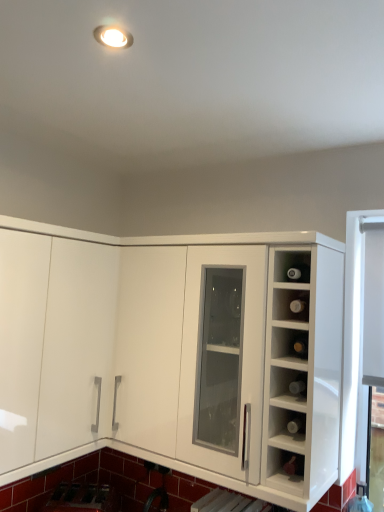
What do you see at coordinates (171, 354) in the screenshot? This screenshot has height=512, width=384. I see `white glossy cabinet at center` at bounding box center [171, 354].

Where is `metallic silver sink at lower left`? metallic silver sink at lower left is located at coordinates (82, 498).

You are a GUI agent. You are given a task and a screenshot of the screen. Output one action in this format:
    pyautogui.click(x=<x>, y=<y>)
    Task: Click on the white glossy cabinet at center
    The height and width of the screenshot is (512, 384).
    Given the screenshot: What is the action you would take?
    pyautogui.click(x=171, y=354)

Does point (71, 498) appear closer or farther from the camera than point (285, 397)?

Point (71, 498).

Is metallic silver sink at lower left positioned behind transparent glass bottles at right?

Yes, metallic silver sink at lower left is further from the viewer.

How many degrees apart are the facing directions of metallic silver sink at lower left and transparent glass bottles at right?

There is a 34.5-degree angle between the facing directions of metallic silver sink at lower left and transparent glass bottles at right.

Is transparent glass bottles at right surrounded by metallic silver sink at lower left?

No, transparent glass bottles at right is not surrounded by metallic silver sink at lower left.

From the image's perspective, between white glossy cabinet at center and transparent glass bottles at right, which one is located above?

white glossy cabinet at center.

Does white glossy cabinet at center turn towards transparent glass bottles at right?

Yes, white glossy cabinet at center is aimed at transparent glass bottles at right.

Is white glossy cabinet at center in front of or behind transparent glass bottles at right in the image?

In the image, white glossy cabinet at center appears in front of transparent glass bottles at right.

Is white glossy cabinet at center taller than transparent glass bottles at right?

Correct, white glossy cabinet at center is much taller as transparent glass bottles at right.

From a real-world perspective, which object rests below the other?

Result: metallic silver sink at lower left, from a real-world perspective.

Does metallic silver sink at lower left have a smaller size compared to white glossy cabinet at center?

Yes.

Which is in front, metallic silver sink at lower left or white glossy cabinet at center?

white glossy cabinet at center is closer to the camera.

Which is more to the right, matte glass wine bottle at upper right or transparent glass bottles at right?

From the viewer's perspective, matte glass wine bottle at upper right appears more on the right side.

Is matte glass wine bottle at upper right outside of transparent glass bottles at right?

Absolutely, matte glass wine bottle at upper right is external to transparent glass bottles at right.

Is matte glass wine bottle at upper right closer to the viewer compared to transparent glass bottles at right?

No, matte glass wine bottle at upper right is behind transparent glass bottles at right.

Looking at this image, can you confirm if matte glass wine bottle at upper right is thinner than transparent glass bottles at right?

Yes, matte glass wine bottle at upper right is thinner than transparent glass bottles at right.

Is matte glass wine bottle at upper right not close to metallic silver sink at lower left?

Indeed, matte glass wine bottle at upper right is not near metallic silver sink at lower left.

From a real-world perspective, which is physically below, matte glass wine bottle at upper right or metallic silver sink at lower left?

In real-world perspective, metallic silver sink at lower left is lower.

Looking at this image, could you tell me if matte glass wine bottle at upper right is facing metallic silver sink at lower left?

No, matte glass wine bottle at upper right is not facing towards metallic silver sink at lower left.

Is point (287, 271) closer or farther from the camera than point (69, 487)?

Clearly, point (287, 271) is closer to the camera than point (69, 487).

Which of these two, transparent glass bottles at right or white glossy cabinet at center, stands taller?

With more height is white glossy cabinet at center.

Is transparent glass bottles at right not close to white glossy cabinet at center?

Actually, transparent glass bottles at right and white glossy cabinet at center are a little close together.

Is transparent glass bottles at right in front of or behind white glossy cabinet at center in the image?

Clearly, transparent glass bottles at right is behind white glossy cabinet at center.

Does transparent glass bottles at right appear on the right side of white glossy cabinet at center?

Yes.

Considering the relative positions of metallic silver sink at lower left and matte glass wine bottle at upper right in the image provided, is metallic silver sink at lower left to the left or to the right of matte glass wine bottle at upper right?

In the image, metallic silver sink at lower left appears on the left side of matte glass wine bottle at upper right.

In the scene shown: Is metallic silver sink at lower left far away from matte glass wine bottle at upper right?

Yes, metallic silver sink at lower left and matte glass wine bottle at upper right are quite far apart.

Considering the sizes of metallic silver sink at lower left and matte glass wine bottle at upper right in the image, is metallic silver sink at lower left bigger or smaller than matte glass wine bottle at upper right?

Clearly, metallic silver sink at lower left is larger in size than matte glass wine bottle at upper right.

From a real-world perspective, is metallic silver sink at lower left over matte glass wine bottle at upper right?

No, from a real-world perspective, metallic silver sink at lower left is not over matte glass wine bottle at upper right

Where is `appliance beneath the transparent glass bottles at right (from a real-world perspective)`? appliance beneath the transparent glass bottles at right (from a real-world perspective) is located at coordinates (82, 498).

Locate an element on the screen. This screenshot has height=512, width=384. cabinetry located on the left of transparent glass bottles at right is located at coordinates (171, 354).

Estimate the real-world distances between objects in this image. Which object is closer to white glossy cabinet at center, matte glass wine bottle at upper right or transparent glass bottles at right?

transparent glass bottles at right.

Considering their positions, is metallic silver sink at lower left positioned closer to white glossy cabinet at center than transparent glass bottles at right?

Among the two, transparent glass bottles at right is located nearer to white glossy cabinet at center.

Estimate the real-world distances between objects in this image. Which object is further from metallic silver sink at lower left, white glossy cabinet at center or transparent glass bottles at right?

transparent glass bottles at right is positioned further to the anchor metallic silver sink at lower left.

Looking at the image, which one is located further to white glossy cabinet at center, transparent glass bottles at right or matte glass wine bottle at upper right?

Based on the image, matte glass wine bottle at upper right appears to be further to white glossy cabinet at center.

Which object lies nearer to the anchor point white glossy cabinet at center, transparent glass bottles at right or metallic silver sink at lower left?

transparent glass bottles at right.

Which object lies nearer to the anchor point metallic silver sink at lower left, matte glass wine bottle at upper right or transparent glass bottles at right?

transparent glass bottles at right is positioned closer to the anchor metallic silver sink at lower left.

Looking at the image, which one is located further to matte glass wine bottle at upper right, metallic silver sink at lower left or white glossy cabinet at center?

metallic silver sink at lower left lies further to matte glass wine bottle at upper right than the other object.

Based on their spatial positions, is matte glass wine bottle at upper right or white glossy cabinet at center further from transparent glass bottles at right?

Among the two, white glossy cabinet at center is located further to transparent glass bottles at right.

At what (x,y) coordinates should I click in order to perform the action: click on cabinetry that lies between matte glass wine bottle at upper right and transparent glass bottles at right from top to bottom. Please return your answer as a coordinate pair (x, y). Looking at the image, I should click on (171, 354).

At what (x,y) coordinates should I click in order to perform the action: click on cabinetry between metallic silver sink at lower left and transparent glass bottles at right in the horizontal direction. Please return your answer as a coordinate pair (x, y). This screenshot has height=512, width=384. Looking at the image, I should click on (171, 354).

The height and width of the screenshot is (512, 384). I want to click on shelf that lies between matte glass wine bottle at upper right and metallic silver sink at lower left from top to bottom, so click(x=288, y=385).

Where is `cabinetry between matte glass wine bottle at upper right and metallic silver sink at lower left from top to bottom`? The image size is (384, 512). cabinetry between matte glass wine bottle at upper right and metallic silver sink at lower left from top to bottom is located at coordinates (171, 354).